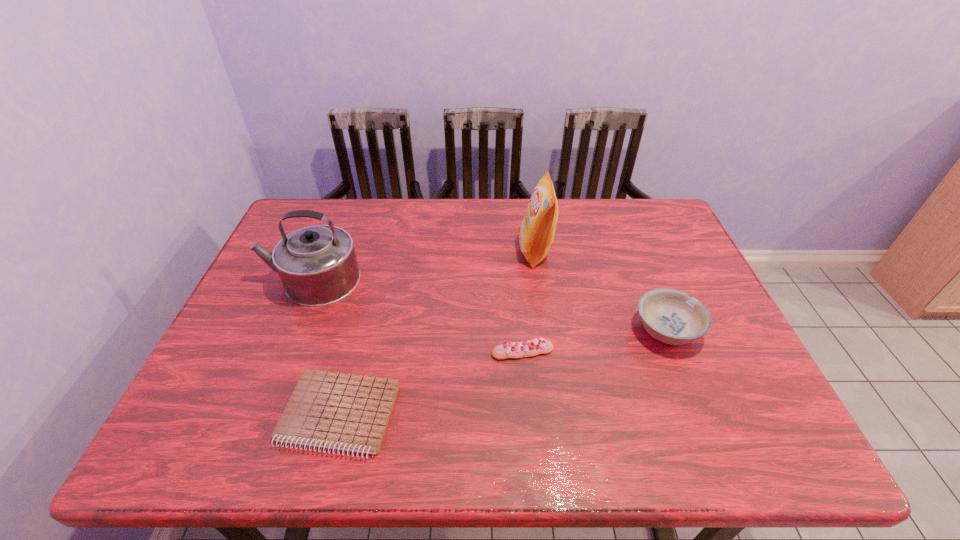
Where is `free space that satisfies the following two spatial constraints: 1. on the back side of the eclair; 2. with the spout at the front of the kettle`? The width and height of the screenshot is (960, 540). free space that satisfies the following two spatial constraints: 1. on the back side of the eclair; 2. with the spout at the front of the kettle is located at coordinates (516, 280).

The image size is (960, 540). I want to click on free spot that satisfies the following two spatial constraints: 1. on the back side of the notebook; 2. on the right side of the eclair, so click(356, 352).